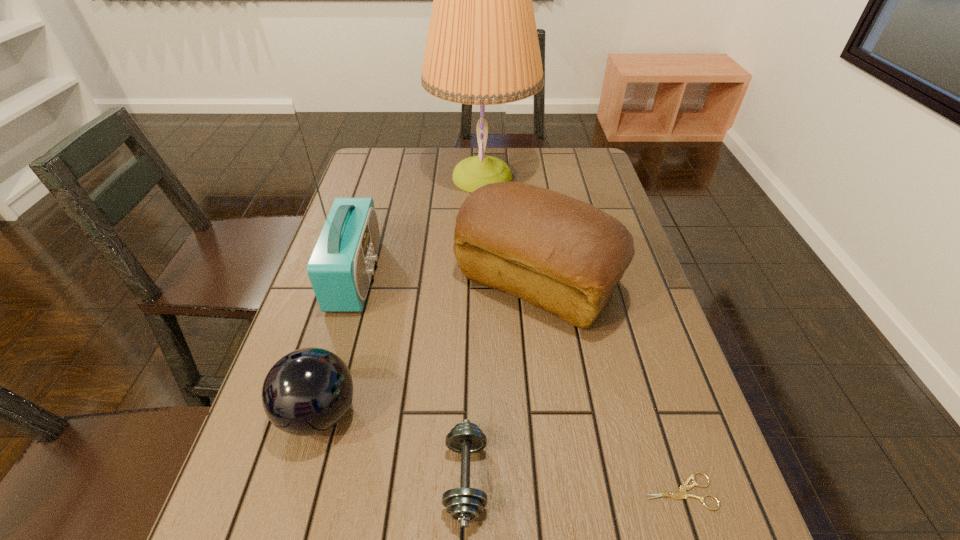
This screenshot has height=540, width=960. I want to click on vacant space that satisfies the following two spatial constraints: 1. on the back side of the fourth shortest object; 2. on the side of the tallest object near the pull switch, so click(x=522, y=177).